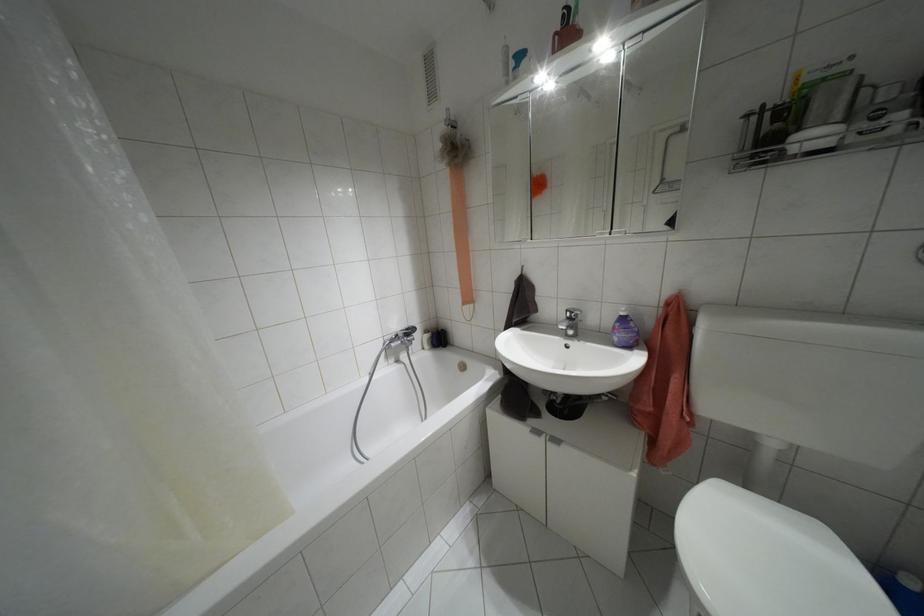
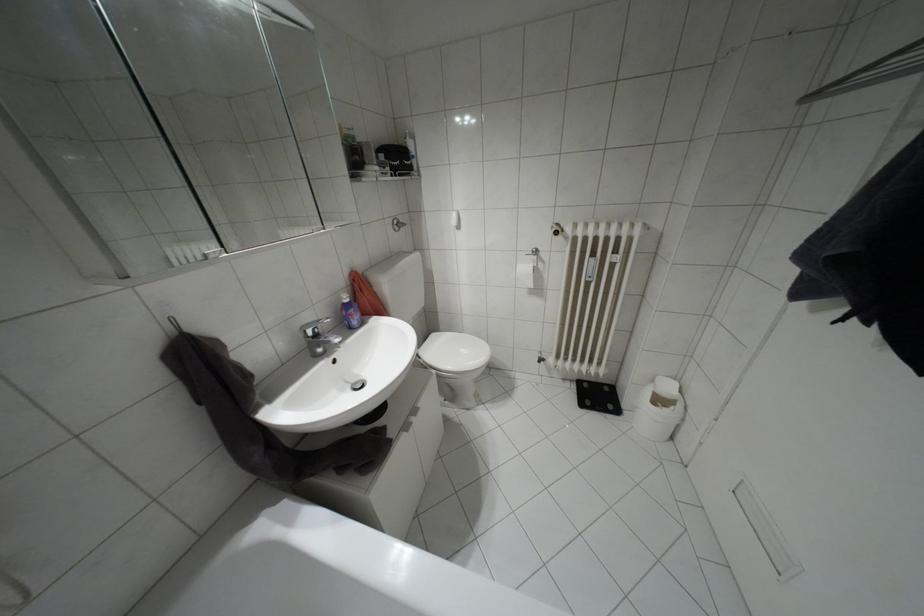
Locate, in the second image, the point that corresponds to (622,313) in the first image.

(346, 300)